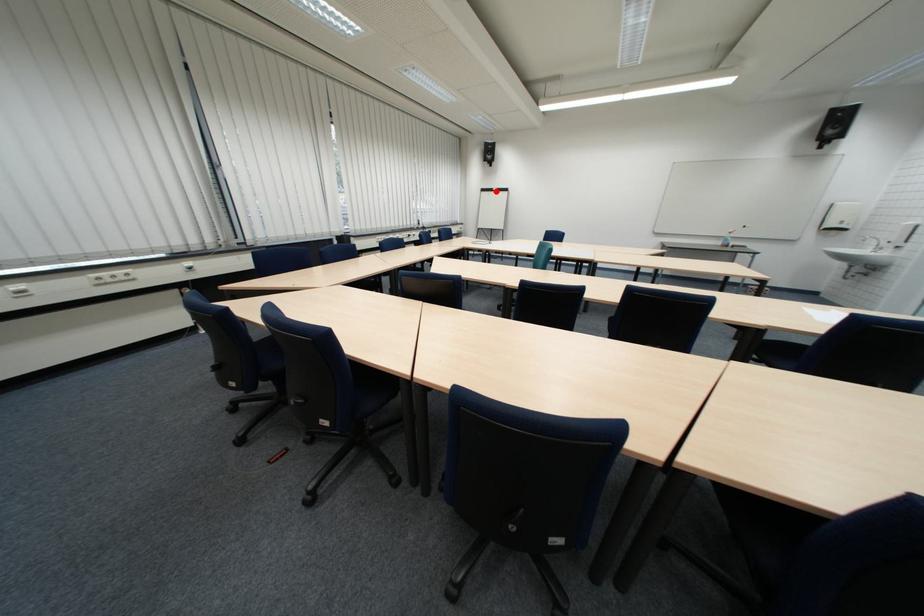
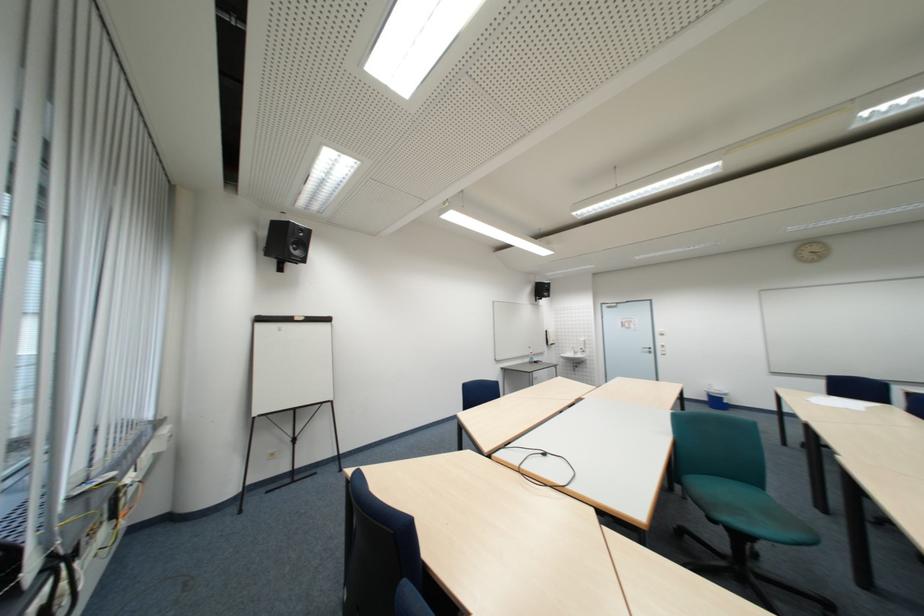
Find the pixel in the second image that matches the highlighted location in the first image.

(273, 321)